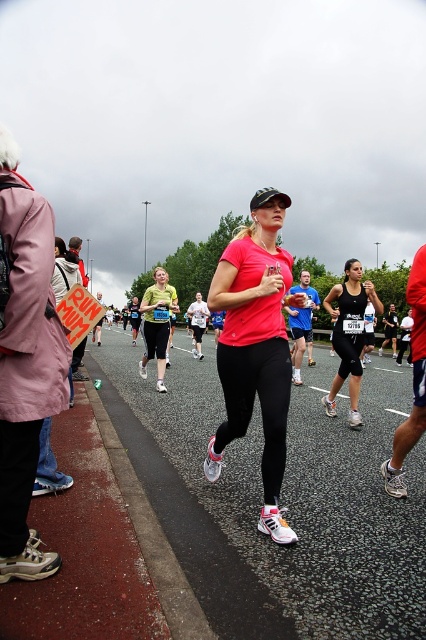
Question: Which of the following is the farthest from the observer?

Choices:
 (A) (275, 337)
 (B) (339, 342)
 (C) (164, 298)

Answer: (C)

Question: Which object is positioned farthest from the matte pink shirt at center?

Choices:
 (A) matte green tank top at center
 (B) black matte tank top at center
 (C) blue fabric shirt at center

Answer: (A)

Question: From the image, what is the correct spatial relationship of matte green tank top at center in relation to wooden signboard at left?

Choices:
 (A) left
 (B) right

Answer: (B)

Question: Is black matte tank top at center below blue fabric shirt at center?

Choices:
 (A) yes
 (B) no

Answer: (A)

Question: Where is matte pink shirt at center located in relation to matte green tank top at center in the image?

Choices:
 (A) below
 (B) above

Answer: (A)

Question: Estimate the real-world distances between objects in this image. Which object is closer to the matte green tank top at center?

Choices:
 (A) blue fabric shirt at center
 (B) matte pink shirt at center

Answer: (A)